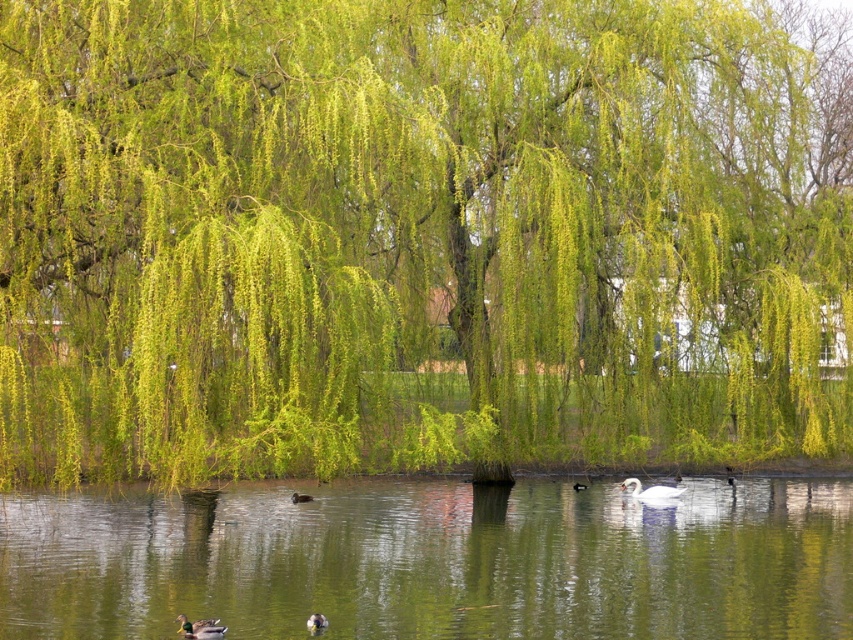
Can you confirm if green reflective water at center is positioned to the left of white glossy goose at center?

Indeed, green reflective water at center is positioned on the left side of white glossy goose at center.

Between green reflective water at center and white glossy goose at center, which one has more height?

green reflective water at center

This screenshot has width=853, height=640. I want to click on green reflective water at center, so click(432, 561).

This screenshot has height=640, width=853. I want to click on green reflective water at center, so click(x=432, y=561).

Is point (296, 492) positioned after point (581, 486)?

No, (296, 492) is closer to viewer.

Is point (310, 496) closer to viewer compared to point (573, 488)?

Yes.

Is point (300, 493) positioned behind point (577, 488)?

No, (300, 493) is closer to viewer.

Identify the location of brown matte duck at lower center. click(x=300, y=497).

Does brown fuzzy duck at lower center have a greater width compared to white matte duck at center?

Incorrect, brown fuzzy duck at lower center's width does not surpass white matte duck at center's.

Is brown fuzzy duck at lower center thinner than white matte duck at center?

Yes.

What do you see at coordinates (316, 621) in the screenshot? The width and height of the screenshot is (853, 640). I see `brown fuzzy duck at lower center` at bounding box center [316, 621].

This screenshot has height=640, width=853. Identify the location of brown fuzzy duck at lower center. (316, 621).